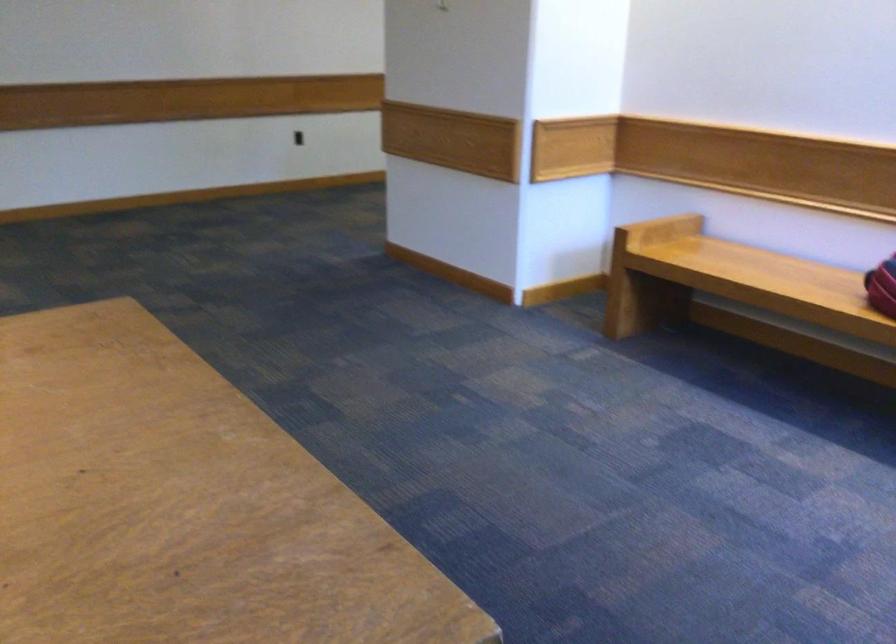
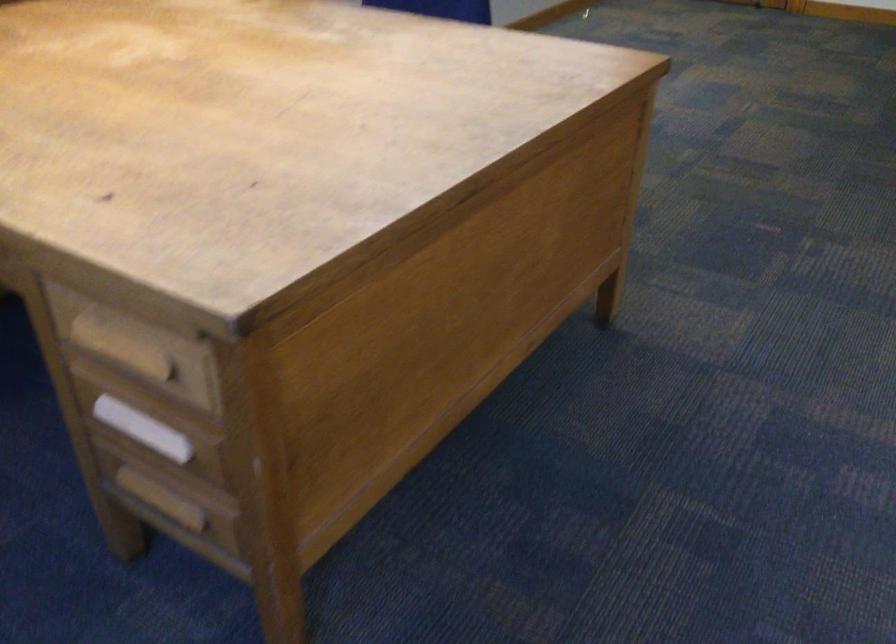
The images are taken continuously from a first-person perspective. In which direction is your viewpoint rotating?

The camera rotated toward left-down.